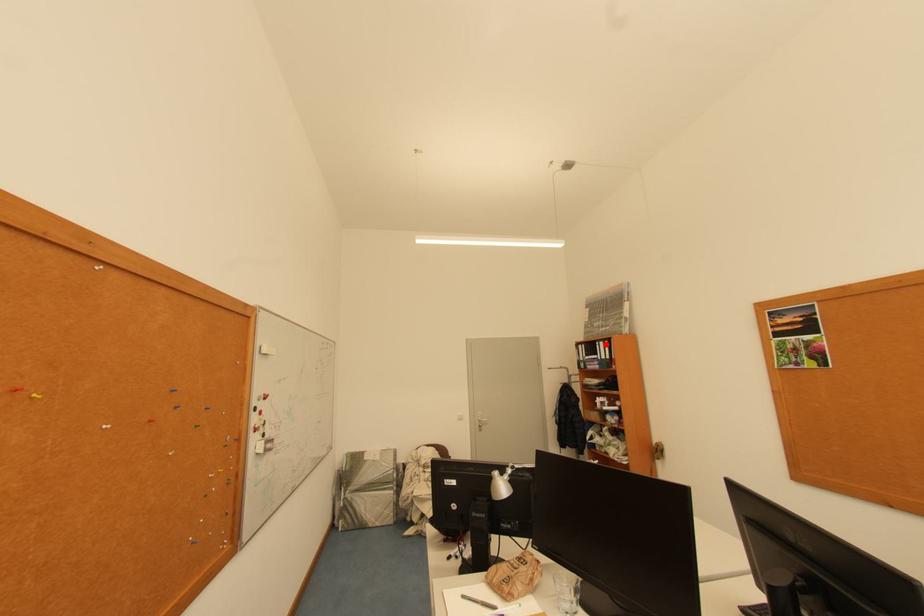
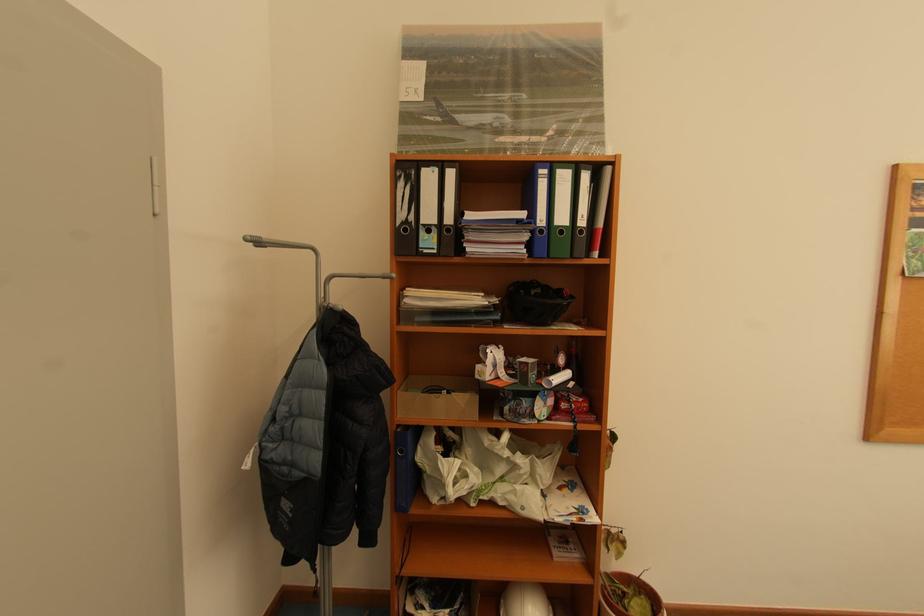
Question: I am providing you with two images of the same scene from different viewpoints. Given a red point in image1, look at the same physical point in image2. Is it:

Choices:
 (A) Closer to the viewpoint
 (B) Farther from the viewpoint

Answer: (A)